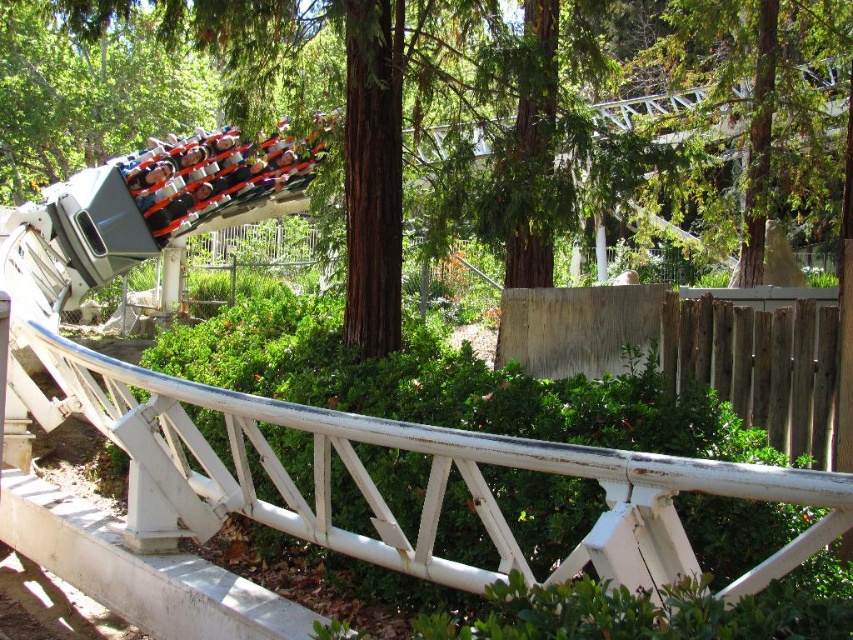
You are a park maintenance worker checking the roller coaster structure. You need to determine if the white matte roller coaster rail at center is lower than the matte black roller coaster at upper left. Based on the scene, what can you conclude?

The white matte roller coaster rail at center has a lesser height compared to the matte black roller coaster at upper left, so it is indeed lower than the matte black roller coaster at upper left.

You are a visitor at the amusement park and want to take a photo of the green textured tree at upper center and the matte black roller coaster at upper left. Which object will appear wider in the photo?

The matte black roller coaster at upper left will appear wider in the photo because it has a greater width than the green textured tree at upper center.

You are standing at the entrance of the amusement park and want to locate the green textured tree at upper center. According to the coordinates provided, where should you look in the image to find it?

The green textured tree at upper center is located at point coordinates (761, 83), so you should look towards the upper center area of the image to find it.